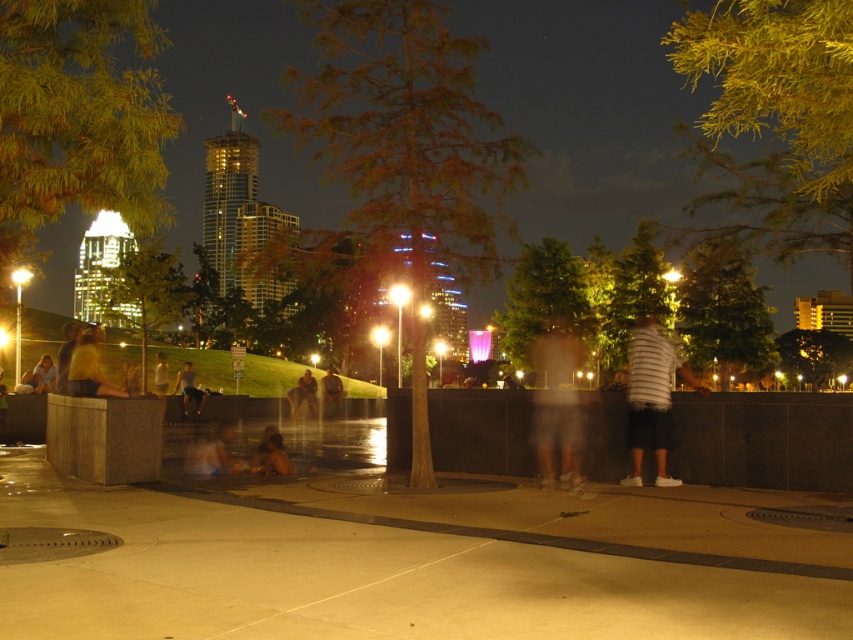
You are standing at the edge of the park and want to reach the smooth concrete pavement at center. According to the coordinates provided, in which direction should you move to reach it?

The smooth concrete pavement at center is located at coordinates point (360,579), so you should move towards the center of the image to reach it.

You are standing at the origin point of the coordinate system in the image and want to find the white striped shirt at center. In which direction should you move to locate it?

The white striped shirt at center is located at coordinates point (653, 396), so you should move towards the right and upward to reach it.